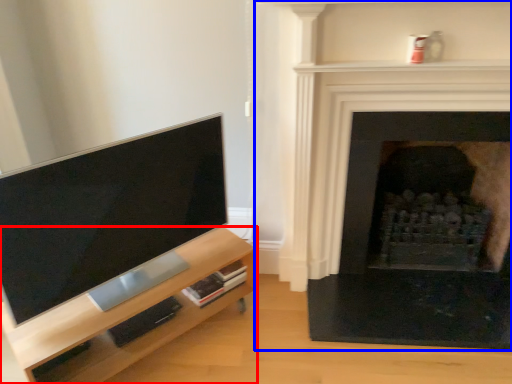
Question: Which object is closer to the camera taking this photo, entertainment center (highlighted by a red box) or fireplace (highlighted by a blue box)?

Choices:
 (A) entertainment center
 (B) fireplace

Answer: (A)